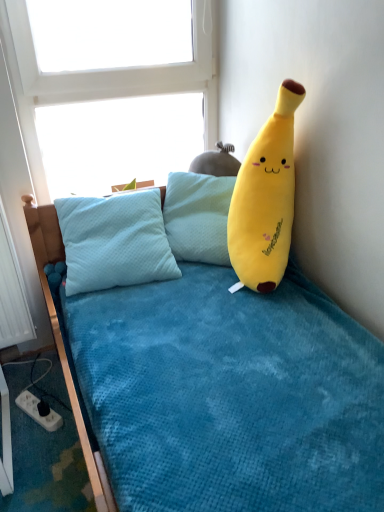
Question: Does soft yellow plush banana at upper right turn towards white plastic power outlet at lower left?

Choices:
 (A) yes
 (B) no

Answer: (B)

Question: Considering the relative sizes of soft yellow plush banana at upper right and white plastic power outlet at lower left in the image provided, is soft yellow plush banana at upper right taller than white plastic power outlet at lower left?

Choices:
 (A) yes
 (B) no

Answer: (A)

Question: From a real-world perspective, is soft yellow plush banana at upper right below white plastic power outlet at lower left?

Choices:
 (A) yes
 (B) no

Answer: (B)

Question: Is white plastic power outlet at lower left inside soft yellow plush banana at upper right?

Choices:
 (A) no
 (B) yes

Answer: (A)

Question: Are soft yellow plush banana at upper right and white plastic power outlet at lower left making contact?

Choices:
 (A) no
 (B) yes

Answer: (A)

Question: Based on their positions, is transparent glass window at upper center located to the left or right of soft yellow plush banana at upper right?

Choices:
 (A) right
 (B) left

Answer: (B)

Question: From a real-world perspective, is transparent glass window at upper center positioned above or below soft yellow plush banana at upper right?

Choices:
 (A) above
 (B) below

Answer: (A)

Question: Is transparent glass window at upper center situated inside soft yellow plush banana at upper right or outside?

Choices:
 (A) outside
 (B) inside

Answer: (A)

Question: In the image, is transparent glass window at upper center positioned in front of or behind soft yellow plush banana at upper right?

Choices:
 (A) behind
 (B) front

Answer: (A)

Question: Do you think transparent glass window at upper center is within white plastic power outlet at lower left, or outside of it?

Choices:
 (A) outside
 (B) inside

Answer: (A)

Question: In the image, is transparent glass window at upper center positioned in front of or behind white plastic power outlet at lower left?

Choices:
 (A) behind
 (B) front

Answer: (B)

Question: In terms of height, does transparent glass window at upper center look taller or shorter compared to white plastic power outlet at lower left?

Choices:
 (A) tall
 (B) short

Answer: (A)

Question: From a real-world perspective, is transparent glass window at upper center physically located above or below white plastic power outlet at lower left?

Choices:
 (A) above
 (B) below

Answer: (A)

Question: Considering their positions, is white plastic power outlet at lower left located in front of or behind soft yellow plush banana at upper right?

Choices:
 (A) behind
 (B) front

Answer: (A)

Question: From the image's perspective, is white plastic power outlet at lower left above or below soft yellow plush banana at upper right?

Choices:
 (A) above
 (B) below

Answer: (B)